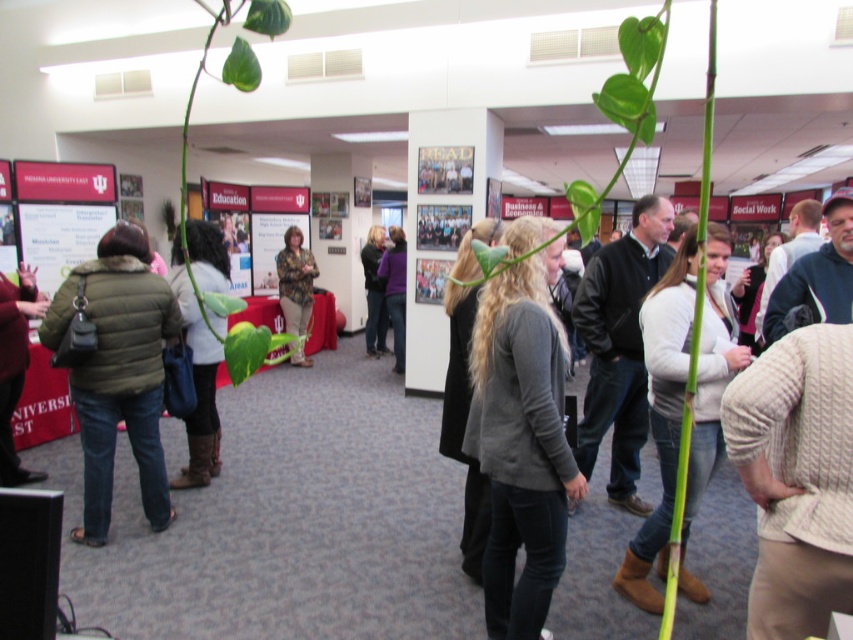
Question: Is green fuzzy jacket at left to the right of camouflage jacket at center from the viewer's perspective?

Choices:
 (A) yes
 (B) no

Answer: (B)

Question: Can you confirm if gray sweater at center is positioned to the left of green fuzzy jacket at left?

Choices:
 (A) no
 (B) yes

Answer: (A)

Question: Does green fuzzy jacket at left have a smaller size compared to camouflage jacket at center?

Choices:
 (A) yes
 (B) no

Answer: (B)

Question: Among these points, which one is farthest from the camera?

Choices:
 (A) (102, 317)
 (B) (281, 260)

Answer: (B)

Question: Which object is positioned farthest from the white sweater at center?

Choices:
 (A) green fuzzy jacket at left
 (B) light brown sweater at center

Answer: (B)

Question: Which object appears closest to the camera in this image?

Choices:
 (A) light brown sweater at center
 (B) purple matte jacket at center

Answer: (A)